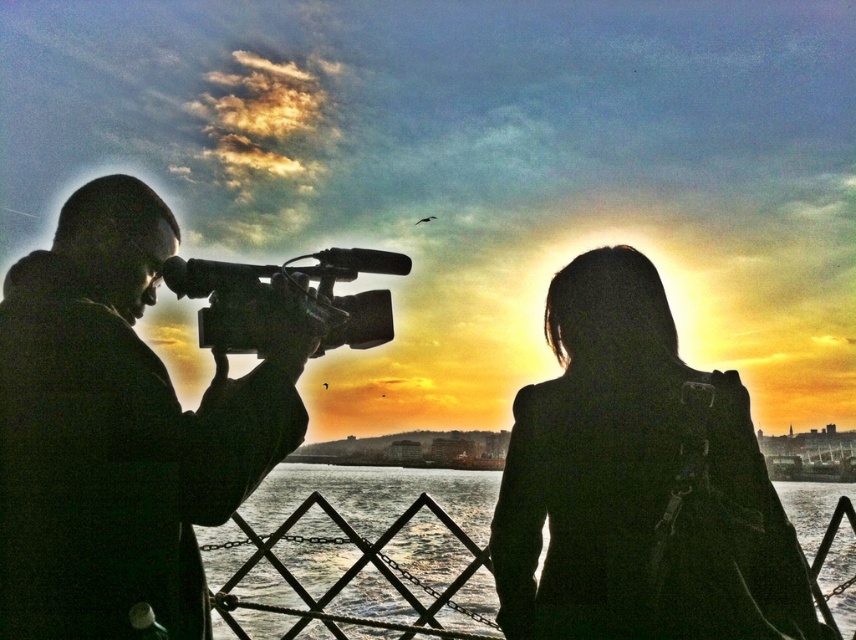
Based on the photo, who is positioned more to the right, black matte coat at upper right or translucent glass water at center?

Positioned to the right is translucent glass water at center.

Is point (688, 636) closer to viewer compared to point (363, 584)?

Yes.

Identify the location of black matte coat at upper right. (638, 483).

How far apart are black matte camera at left and black matte coat at upper right?

They are 1.39 meters apart.

Measure the distance from black matte camera at left to black matte coat at upper right.

The distance of black matte camera at left from black matte coat at upper right is 4.57 feet.

Locate an element on the screen. This screenshot has width=856, height=640. black matte camera at left is located at coordinates click(134, 413).

Who is positioned more to the left, translucent glass water at center or black plastic video camera at left?

From the viewer's perspective, black plastic video camera at left appears more on the left side.

Can you confirm if translucent glass water at center is thinner than black plastic video camera at left?

Incorrect, translucent glass water at center's width is not less than black plastic video camera at left's.

Image resolution: width=856 pixels, height=640 pixels. Describe the element at coordinates (396, 516) in the screenshot. I see `translucent glass water at center` at that location.

Identify the location of translucent glass water at center. click(x=396, y=516).